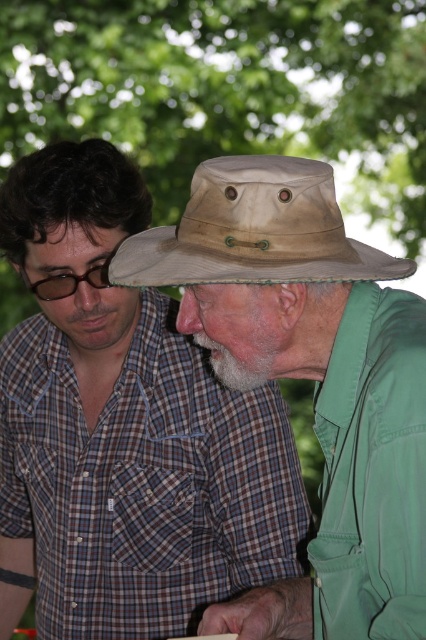
Which is in front, point (259, 241) or point (5, 477)?

Point (259, 241)

What do you see at coordinates (310, 378) in the screenshot?
I see `khaki fabric hat at center` at bounding box center [310, 378].

Is point (302, 209) positioned before point (198, 406)?

Yes, it is.

Where is `khaki fabric hat at center`? The height and width of the screenshot is (640, 426). khaki fabric hat at center is located at coordinates (310, 378).

Does plaid cotton shirt at center have a greater width compared to tan canvas hat at center?

Yes.

Which is in front, point (184, 480) or point (345, 268)?

Point (345, 268) is more forward.

This screenshot has height=640, width=426. I want to click on plaid cotton shirt at center, so click(143, 483).

Which is below, khaki fabric hat at center or tan canvas hat at center?

Positioned lower is khaki fabric hat at center.

Who is positioned more to the left, khaki fabric hat at center or tan canvas hat at center?

tan canvas hat at center is more to the left.

Measure the distance between point (420, 400) and camera.

They are 1.05 meters apart.

At what (x,y) coordinates should I click in order to perform the action: click on khaki fabric hat at center. Please return your answer as a coordinate pair (x, y). The image size is (426, 640). Looking at the image, I should click on (310, 378).